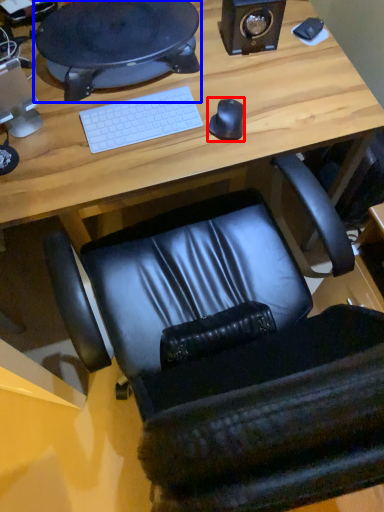
Question: Which of the following is the closest to the observer, mouse (highlighted by a red box) or desktop (highlighted by a blue box)?

Choices:
 (A) mouse
 (B) desktop

Answer: (A)